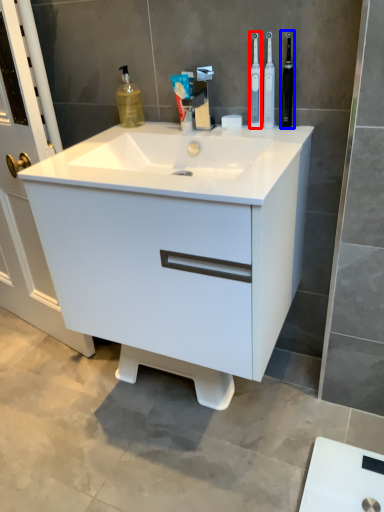
Question: Which object appears farthest to the camera in this image, toothbrush (highlighted by a red box) or toiletry (highlighted by a blue box)?

Choices:
 (A) toothbrush
 (B) toiletry

Answer: (A)